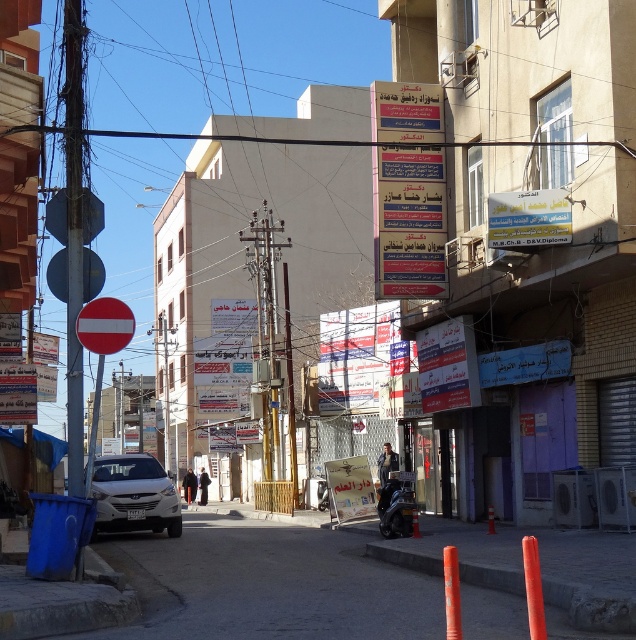
Question: Where is white matte car at center located in relation to red matte circle at left in the image?

Choices:
 (A) below
 (B) above

Answer: (A)

Question: Which point is farther to the camera?

Choices:
 (A) blue paper sign at center
 (B) shiny black motorcycle at center

Answer: (B)

Question: Can you confirm if blue paper sign at center is positioned to the left of shiny black motorcycle at center?

Choices:
 (A) no
 (B) yes

Answer: (A)

Question: Considering the real-world distances, which object is closest to the white matte car at center?

Choices:
 (A) red matte circle at left
 (B) blue paper sign at center
 (C) shiny black motorcycle at center

Answer: (A)

Question: Which point is closer to the camera?

Choices:
 (A) (384, 113)
 (B) (127, 342)
 (C) (146, 481)

Answer: (B)

Question: Can you confirm if blue paper sign at center is smaller than white matte car at center?

Choices:
 (A) yes
 (B) no

Answer: (B)